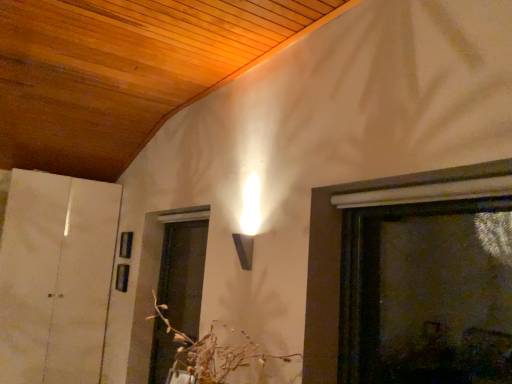
Question: From their relative heights in the image, would you say white paper at left is taller or shorter than translucent glass screen door at lower center?

Choices:
 (A) short
 (B) tall

Answer: (B)

Question: Does point (73, 344) appear closer or farther from the camera than point (198, 334)?

Choices:
 (A) closer
 (B) farther

Answer: (B)

Question: Considering the real-world distances, which object is farthest from the white paper at left?

Choices:
 (A) translucent glass screen door at lower center
 (B) brown textured floral arrangement at center

Answer: (B)

Question: Considering the real-world distances, which object is closest to the translucent glass screen door at lower center?

Choices:
 (A) white paper at left
 (B) brown textured floral arrangement at center

Answer: (A)